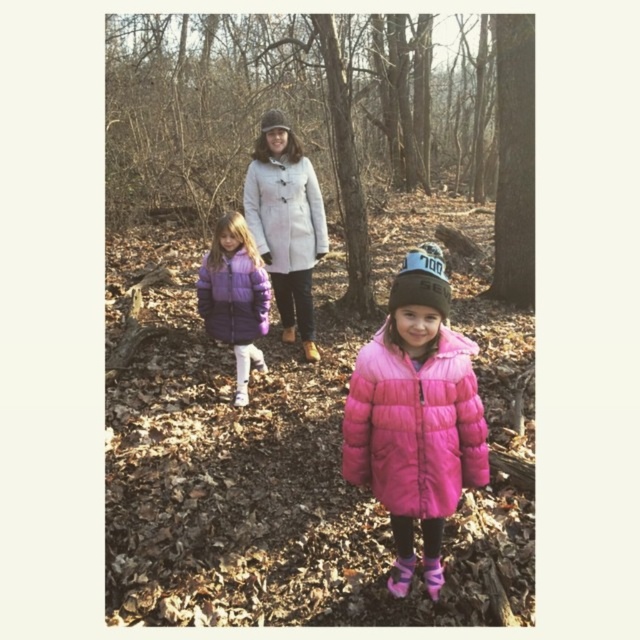
You are a photographer trying to capture both the purple down jacket at center and the white woolen coat at center in the same frame. Which one should you focus on first to ensure both are in focus?

The purple down jacket at center is taller than the white woolen coat at center, so you should focus on the purple down jacket at center first to ensure both are in focus.

You are a photographer trying to capture both the purple down jacket at center and the brown suede boot at center in a single shot. Based on their positions, which one should you focus on first to ensure both are in frame?

The purple down jacket at center is located above the brown suede boot at center, so you should focus on the purple down jacket at center first to ensure both are in frame.